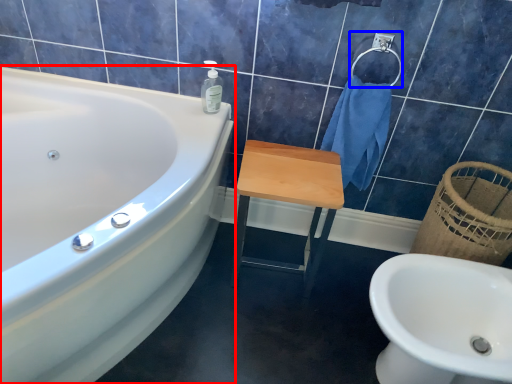
Question: Which object is further to the camera taking this photo, bathtub (highlighted by a red box) or towel bar (highlighted by a blue box)?

Choices:
 (A) bathtub
 (B) towel bar

Answer: (B)